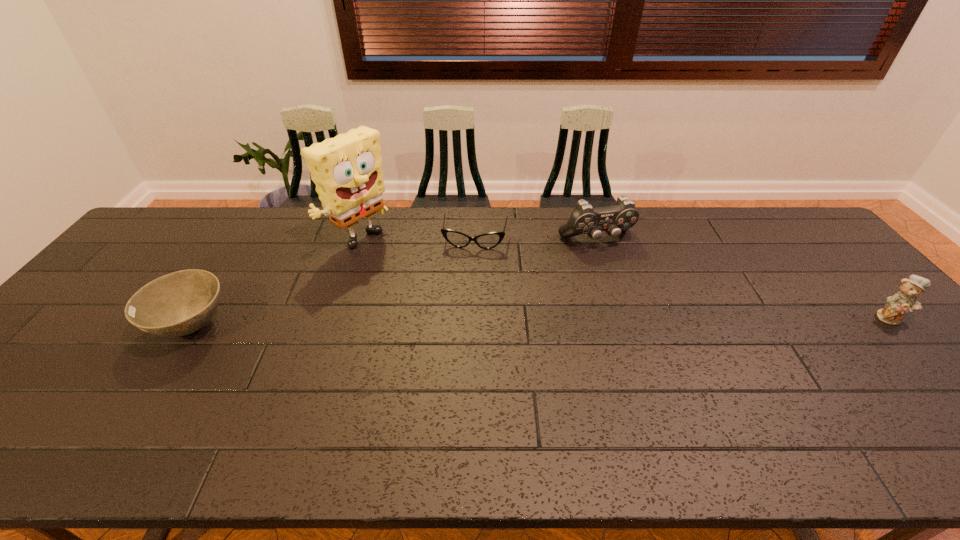
Identify the location of vacant space that satisfies the following two spatial constraints: 1. on the back side of the second shortest object; 2. on the left side of the tallest object. [x=246, y=242].